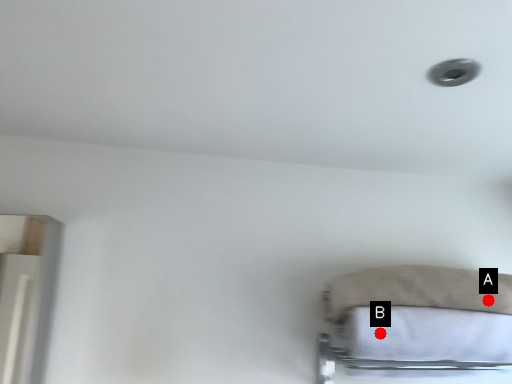
Question: Two points are circled on the image, labeled by A and B beside each circle. Which point is closer to the camera taking this photo?

Choices:
 (A) A is closer
 (B) B is closer

Answer: (B)